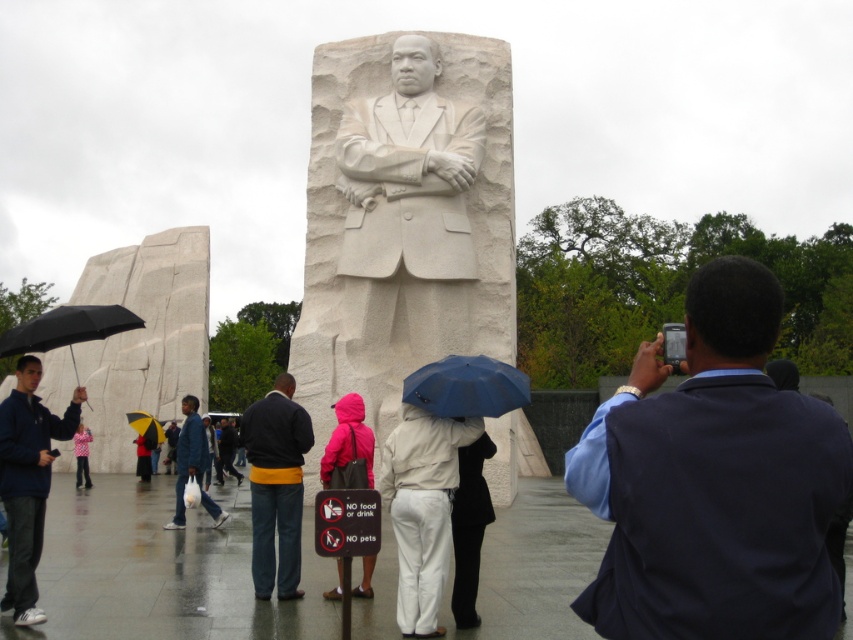
You are standing near the Martin Luther King Jr. Memorial and see a person wearing a dark blue jacket at left and holding a black matte umbrella at left. If you want to approach the person from the right side, which object should you walk around?

You should walk around the dark blue jacket at left because it is positioned to the right of the black matte umbrella at left, so approaching from the right side would mean moving past the jacket first.